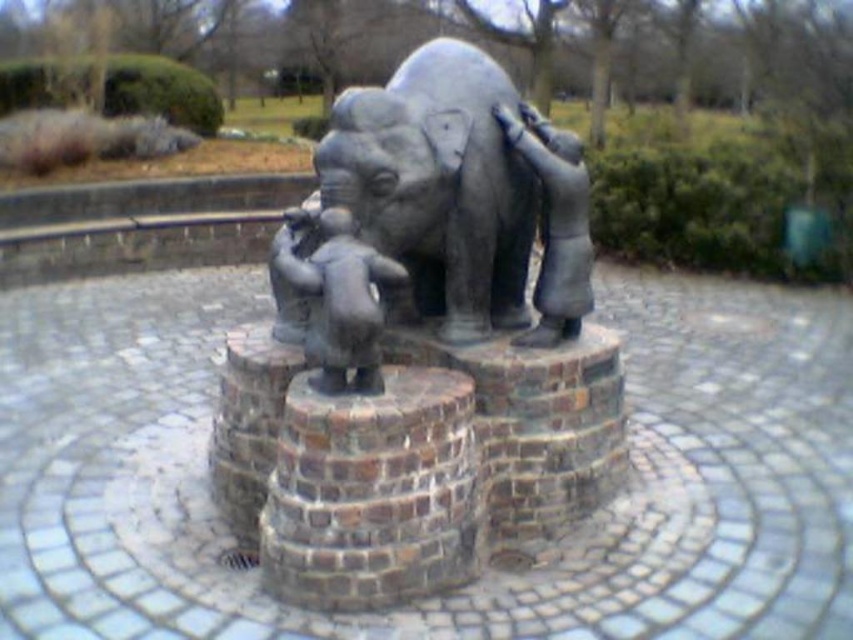
You are a visitor standing in front of the sculpture. You want to take a photo of the bronze statue of elephant at center and the brown brick stump at center. Which object should you focus on first if you want to capture both in the frame without moving your camera? Explain your reasoning based on their positions.

The bronze statue of elephant at center is positioned on the right side of brown brick stump at center. To capture both in the frame without moving the camera, you should focus on the brown brick stump at center first since it is closer to the left side, allowing the statue to be included on its right side in the same shot.

You are standing at the center of the sculpture area. You want to place a new decorative stone exactly at the same position as the brown brick stump at center. What are the coordinates where you should place the new stone?

The coordinates for the brown brick stump at center are at point [373,492], so you should place the new decorative stone at those exact coordinates.

You are standing at the center of the sculpture base and want to place a decorative stone at the point marked by the coordinates point (373, 492). Based on the scene description, where exactly should you place this stone?

The point (373, 492) marks the brown brick stump at center, so you should place the decorative stone on the brown brick stump at center.